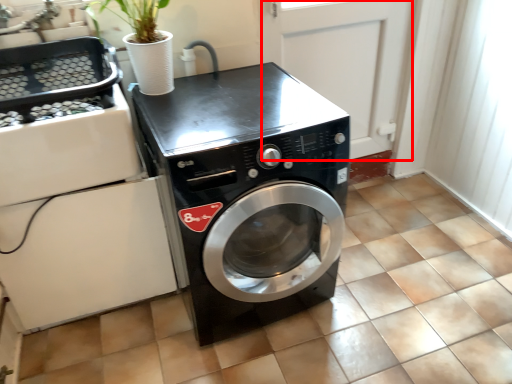
Question: From the image's perspective, what is the correct spatial relationship of screen door (annotated by the red box) in relation to washing machine?

Choices:
 (A) below
 (B) above

Answer: (B)